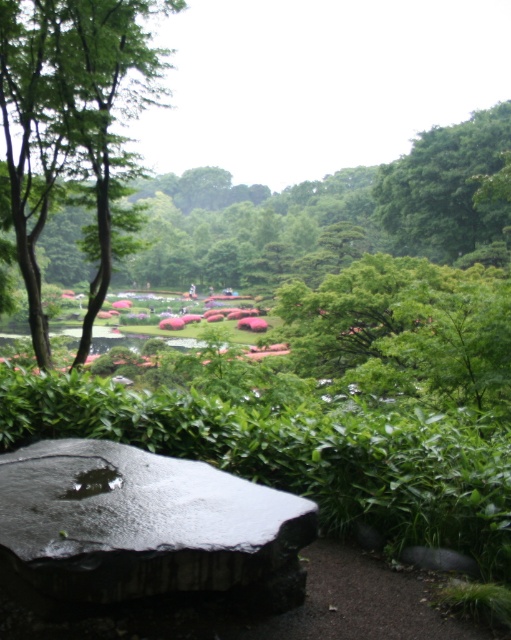
Question: Where is green leafy tree at left located in relation to green leafy tree at upper right in the image?

Choices:
 (A) right
 (B) left

Answer: (B)

Question: From the image, what is the correct spatial relationship of green leafy tree at left in relation to green leafy tree at upper right?

Choices:
 (A) below
 (B) above

Answer: (A)

Question: Which object is the closest to the green leafy tree at upper right?

Choices:
 (A) shiny black stone at lower left
 (B) green leafy tree at left

Answer: (B)

Question: Which of these objects is positioned farthest from the green leafy tree at upper right?

Choices:
 (A) shiny black stone at lower left
 (B) green leafy tree at left

Answer: (A)

Question: Which of these objects is positioned closest to the shiny black stone at lower left?

Choices:
 (A) green leafy tree at left
 (B) green leafy tree at upper right

Answer: (A)

Question: Is shiny black stone at lower left closer to the viewer compared to green leafy tree at upper right?

Choices:
 (A) no
 (B) yes

Answer: (B)